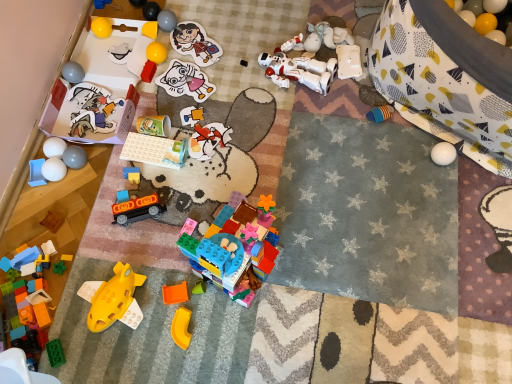
Where is `free space to the right of matte gray ball at upper center, which is the 18th toy in left-to-right order`? The height and width of the screenshot is (384, 512). free space to the right of matte gray ball at upper center, which is the 18th toy in left-to-right order is located at coordinates (211, 32).